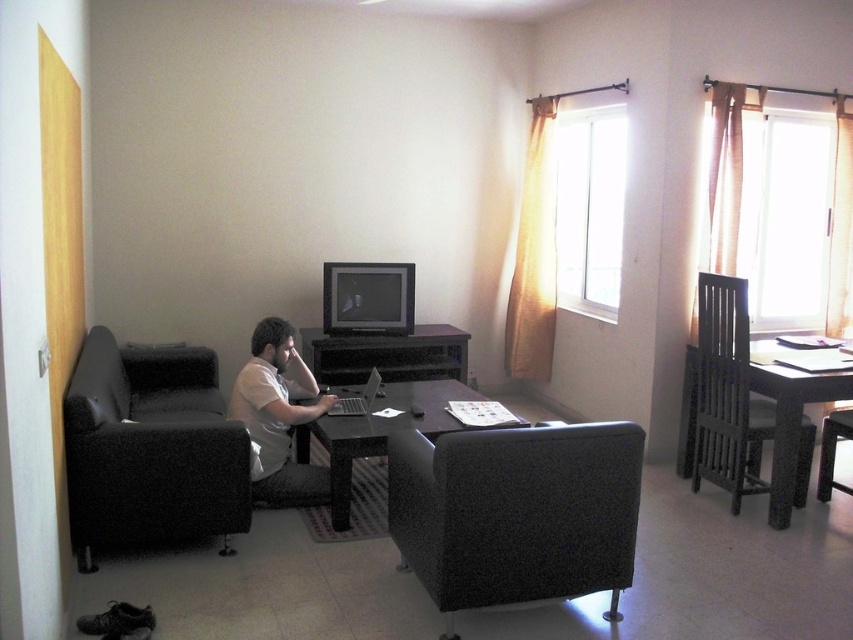
You are standing in the living room and want to pick up an object. There are two points marked in the scene, point (519, 518) and point (352, 410). Which point is closer to you?

Point (519, 518) is closer to the camera than point (352, 410), so the point closer to you is point (519, 518).

You are a person sitting on the sofa. You want to reach the silver metallic laptop at center without moving from your seat. Can you directly see the laptop from your current position, considering the black wooden table at right is blocking your view?

The black wooden table at right is in front of the silver metallic laptop at center, so it is blocking your view. You cannot directly see the laptop from your current position on the sofa.

You are planning to place a new rectangular side table between the black fabric chair at lower right and the silver metallic laptop at center. The side table is 1.2 meters wide. Is there enough space between them to fit the table?

The black fabric chair at lower right is narrower than the silver metallic laptop at center. However, the width of the chair and laptop are not provided, so it is impossible to determine if the 1.2 meter wide side table can fit between them based on the given information.